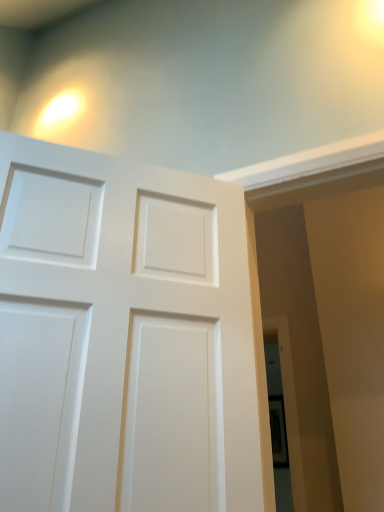
Identify the location of white matte door at left. The image size is (384, 512). (139, 326).

The height and width of the screenshot is (512, 384). Describe the element at coordinates (139, 326) in the screenshot. I see `white matte door at left` at that location.

You are a GUI agent. You are given a task and a screenshot of the screen. Output one action in this format:
    pyautogui.click(x=<x>, y=<y>)
    Task: Click on the white matte door at left
    The width and height of the screenshot is (384, 512).
    Given the screenshot: What is the action you would take?
    pyautogui.click(x=139, y=326)